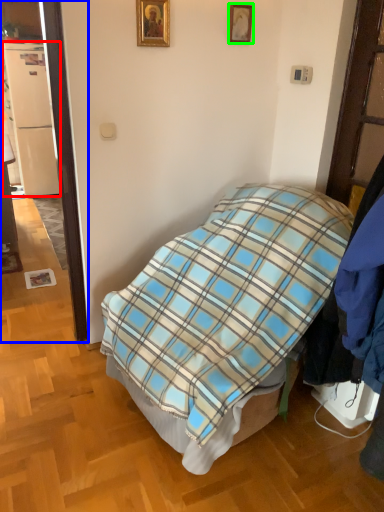
Question: Considering the real-world distances, which object is farthest from refrigerator (highlighted by a red box)? door (highlighted by a blue box) or picture frame (highlighted by a green box)?

Choices:
 (A) door
 (B) picture frame

Answer: (B)